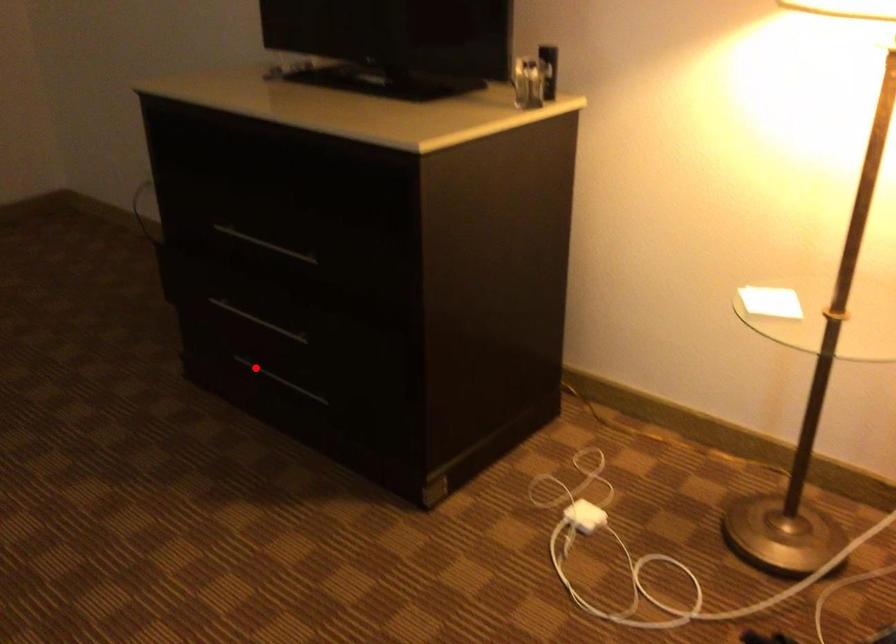
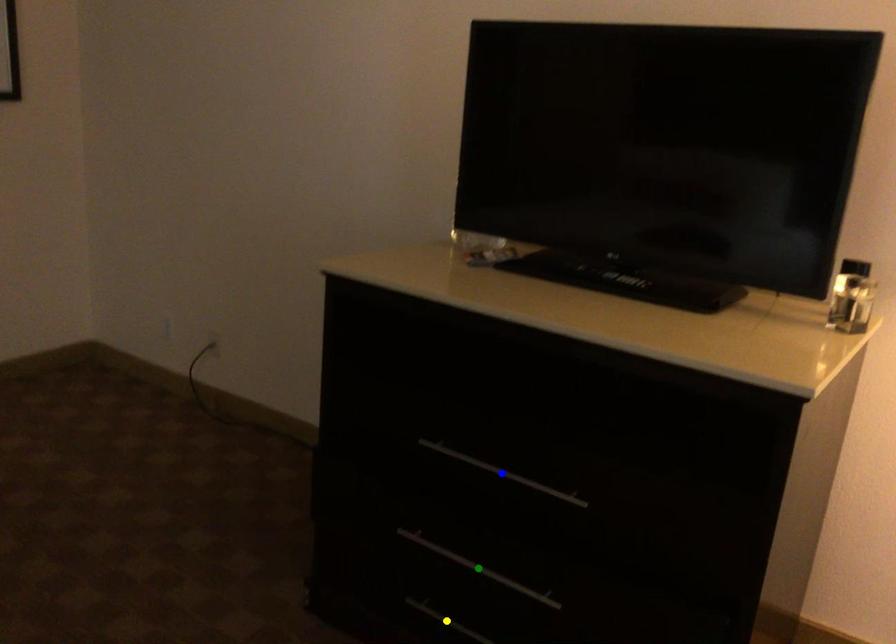
Question: I am providing you with two images of the same scene from different viewpoints. A red point is marked on the first image. You are given multiple points on the second image. Can you choose the point in image 2 that corresponds to the point in image 1?

Choices:
 (A) yellow point
 (B) green point
 (C) blue point

Answer: (A)